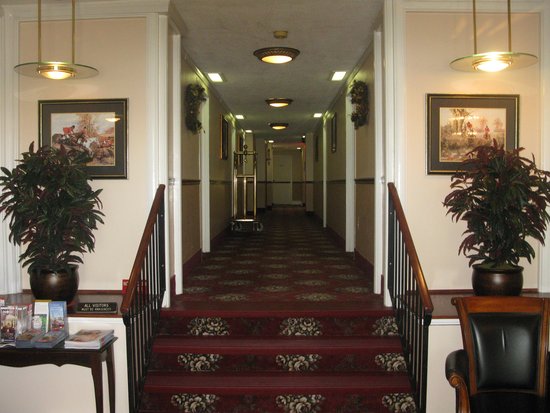
Locate an element on the screen. The width and height of the screenshot is (550, 413). ceiling is located at coordinates (332, 43).